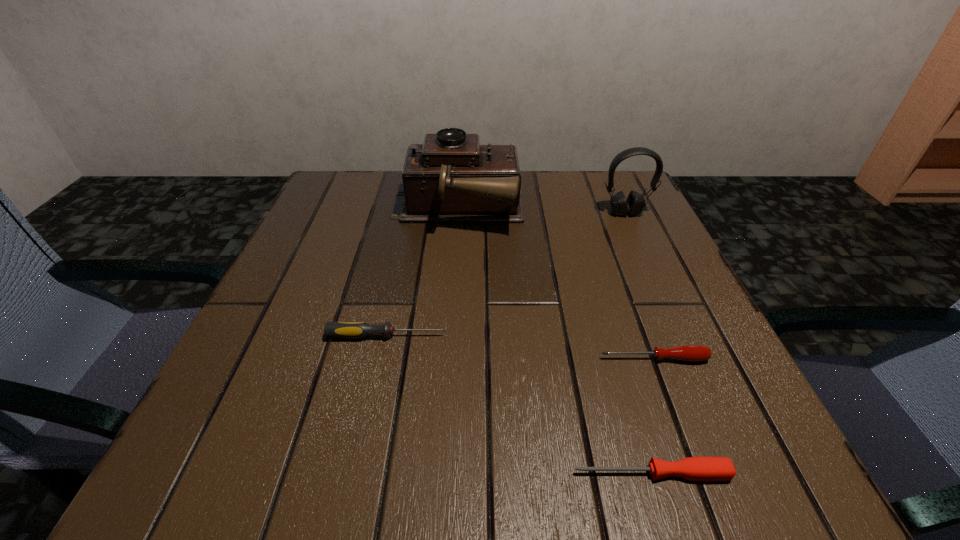
Where is `phonograph_record`? phonograph_record is located at coordinates (450, 178).

Identify the location of headset. The height and width of the screenshot is (540, 960). (635, 203).

Identify the location of the leftmost screwdriver. Image resolution: width=960 pixels, height=540 pixels. (356, 330).

You are a GUI agent. You are given a task and a screenshot of the screen. Output one action in this format:
    pyautogui.click(x=<x>, y=<y>)
    Task: Click on the third farthest object
    The image size is (960, 540).
    Given the screenshot: What is the action you would take?
    pyautogui.click(x=356, y=330)

Where is `the second nearest screwdriver`? The width and height of the screenshot is (960, 540). the second nearest screwdriver is located at coordinates (692, 353).

Locate an element on the screen. the nearest screwdriver is located at coordinates (700, 468).

At what (x,y) coordinates should I click in order to perform the action: click on vacant space located 0.140m on the horn of the phonograph_record. Please return your answer as a coordinate pair (x, y). Looking at the image, I should click on (585, 211).

Locate an element on the screen. vacant space located on the front-facing side of the headset is located at coordinates pos(646,258).

Find the location of a particular element. The width and height of the screenshot is (960, 540). free space located 0.260m insert the farthest screwdriver into a screw head is located at coordinates (605, 336).

Find the location of `vacant space located on the front of the second nearest object`. vacant space located on the front of the second nearest object is located at coordinates pos(676,418).